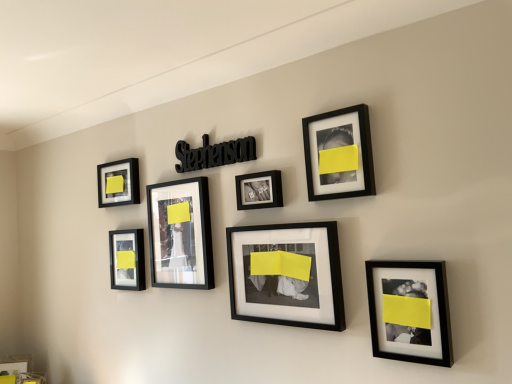
This screenshot has width=512, height=384. In order to click on matte black frame at center, which ranks as the 3th picture frame in left-to-right order in this screenshot , I will do `click(180, 234)`.

What do you see at coordinates (409, 311) in the screenshot?
I see `black matte picture frame at lower right, acting as the 1th picture frame starting from the right` at bounding box center [409, 311].

Describe the element at coordinates (286, 275) in the screenshot. I see `matte black frame at center, which ranks as the third picture frame in right-to-left order` at that location.

Identify the location of matte black frame at center, which ranks as the third picture frame in right-to-left order. The height and width of the screenshot is (384, 512). (286, 275).

Locate an element on the screen. The image size is (512, 384). matte black frame at center, the fifth picture frame in the right-to-left sequence is located at coordinates (180, 234).

Which object is closer to the camera, matte black picture frame at upper left, which ranks as the seventh picture frame in right-to-left order, or matte black frame at center, the fifth picture frame in the right-to-left sequence?

Positioned in front is matte black frame at center, the fifth picture frame in the right-to-left sequence.

Is point (121, 186) farther from camera compared to point (168, 194)?

Yes, it is.

Is matte black picture frame at upper left, acting as the first picture frame starting from the left, spatially inside matte black frame at center, the fifth picture frame in the right-to-left sequence, or outside of it?

matte black picture frame at upper left, acting as the first picture frame starting from the left, exists outside the volume of matte black frame at center, the fifth picture frame in the right-to-left sequence.

From the image's perspective, which one is positioned higher, matte black picture frame at upper left, acting as the first picture frame starting from the left, or matte black frame at center, which ranks as the 3th picture frame in left-to-right order?

matte black picture frame at upper left, acting as the first picture frame starting from the left, appears higher in the image.

Visually, is matte black frame at center, marked as the fifth picture frame in a left-to-right arrangement, positioned to the left or to the right of matte black frame at center, which ranks as the 3th picture frame in left-to-right order?

Based on their positions, matte black frame at center, marked as the fifth picture frame in a left-to-right arrangement, is located to the right of matte black frame at center, which ranks as the 3th picture frame in left-to-right order.

Which is in front, matte black frame at center, marked as the fifth picture frame in a left-to-right arrangement, or matte black frame at center, which ranks as the 3th picture frame in left-to-right order?

matte black frame at center, marked as the fifth picture frame in a left-to-right arrangement.

Considering the sizes of objects matte black frame at center, which ranks as the third picture frame in right-to-left order, and matte black frame at center, which ranks as the 3th picture frame in left-to-right order, in the image provided, who is thinner, matte black frame at center, which ranks as the third picture frame in right-to-left order, or matte black frame at center, which ranks as the 3th picture frame in left-to-right order,?

matte black frame at center, which ranks as the third picture frame in right-to-left order, is thinner.

Is matte black frame at center, marked as the fifth picture frame in a left-to-right arrangement, taller or shorter than matte black frame at center, the fifth picture frame in the right-to-left sequence?

Clearly, matte black frame at center, marked as the fifth picture frame in a left-to-right arrangement, is shorter compared to matte black frame at center, the fifth picture frame in the right-to-left sequence.

In the scene shown: From the image's perspective, which one is positioned lower, matte black frame at center, which ranks as the 3th picture frame in left-to-right order, or black matte picture frame at lower right, acting as the 1th picture frame starting from the right?

black matte picture frame at lower right, acting as the 1th picture frame starting from the right.

Visually, is matte black frame at center, which ranks as the 3th picture frame in left-to-right order, positioned to the left or to the right of black matte picture frame at lower right, which ranks as the 7th picture frame in left-to-right order?

matte black frame at center, which ranks as the 3th picture frame in left-to-right order, is positioned on black matte picture frame at lower right, which ranks as the 7th picture frame in left-to-right order,'s left side.

How many degrees apart are the facing directions of matte black frame at center, the fifth picture frame in the right-to-left sequence, and black matte picture frame at lower right, acting as the 1th picture frame starting from the right?

The facing directions of matte black frame at center, the fifth picture frame in the right-to-left sequence, and black matte picture frame at lower right, acting as the 1th picture frame starting from the right, are 0.00136 degrees apart.

Can you confirm if matte black frame at center, which ranks as the 3th picture frame in left-to-right order, is shorter than black matte picture frame at lower right, acting as the 1th picture frame starting from the right?

Incorrect, the height of matte black frame at center, which ranks as the 3th picture frame in left-to-right order, does not fall short of that of black matte picture frame at lower right, acting as the 1th picture frame starting from the right.

You are a GUI agent. You are given a task and a screenshot of the screen. Output one action in this format:
    pyautogui.click(x=<x>, y=<y>)
    Task: Click on the picture frame above the matte black picture frame at upper left, which ranks as the seventh picture frame in right-to-left order (from the image's perspective)
    This screenshot has width=512, height=384.
    Given the screenshot: What is the action you would take?
    pyautogui.click(x=339, y=154)

From a real-world perspective, is matte black picture frame at upper left, acting as the first picture frame starting from the left, physically located above or below black matte picture frame at upper right, the sixth picture frame viewed from the left?

From a real-world perspective, matte black picture frame at upper left, acting as the first picture frame starting from the left, is physically above black matte picture frame at upper right, the sixth picture frame viewed from the left.

From the image's perspective, is matte black picture frame at upper left, which ranks as the seventh picture frame in right-to-left order, above or below black matte picture frame at upper right, the sixth picture frame viewed from the left?

matte black picture frame at upper left, which ranks as the seventh picture frame in right-to-left order, is below black matte picture frame at upper right, the sixth picture frame viewed from the left.

Is matte black picture frame at upper left, acting as the first picture frame starting from the left, aimed at black matte picture frame at upper right, the sixth picture frame viewed from the left?

No, matte black picture frame at upper left, acting as the first picture frame starting from the left, is not aimed at black matte picture frame at upper right, the sixth picture frame viewed from the left.

Is point (140, 276) behind point (446, 341)?

Yes, it is behind point (446, 341).

Looking at this image, is matte black picture frame at lower left, the 6th picture frame when ordered from right to left, facing towards black matte picture frame at lower right, acting as the 1th picture frame starting from the right?

No, matte black picture frame at lower left, the 6th picture frame when ordered from right to left, does not turn towards black matte picture frame at lower right, acting as the 1th picture frame starting from the right.

Looking at their sizes, would you say matte black picture frame at lower left, the 6th picture frame when ordered from right to left, is wider or thinner than black matte picture frame at lower right, acting as the 1th picture frame starting from the right?

In the image, matte black picture frame at lower left, the 6th picture frame when ordered from right to left, appears to be more narrow than black matte picture frame at lower right, acting as the 1th picture frame starting from the right.

Which object is closer to the camera taking this photo, black matte picture frame at upper right, the sixth picture frame viewed from the left, or matte black picture frame at upper left, acting as the first picture frame starting from the left?

black matte picture frame at upper right, the sixth picture frame viewed from the left, is in front.

Considering the sizes of objects black matte picture frame at upper right, the 2th picture frame viewed from the right, and matte black picture frame at upper left, acting as the first picture frame starting from the left, in the image provided, who is wider, black matte picture frame at upper right, the 2th picture frame viewed from the right, or matte black picture frame at upper left, acting as the first picture frame starting from the left,?

black matte picture frame at upper right, the 2th picture frame viewed from the right.

How many degrees apart are the facing directions of black matte picture frame at upper right, the 2th picture frame viewed from the right, and matte black picture frame at upper left, acting as the first picture frame starting from the left?

They differ by 5.27e-05 degrees in their facing directions.

Between point (359, 117) and point (105, 185), which one is positioned in front?

The point (359, 117) is more forward.

Could you measure the distance between matte black picture frame at lower left, the 2th picture frame in the left-to-right sequence, and matte black photo frame at center, marked as the 4th picture frame in a right-to-left arrangement?

matte black picture frame at lower left, the 2th picture frame in the left-to-right sequence, and matte black photo frame at center, marked as the 4th picture frame in a right-to-left arrangement, are 26.17 inches apart from each other.

From the image's perspective, between matte black picture frame at lower left, the 2th picture frame in the left-to-right sequence, and matte black photo frame at center, positioned as the 4th picture frame in left-to-right order, which one is located above?

matte black photo frame at center, positioned as the 4th picture frame in left-to-right order, appears higher in the image.

Does matte black picture frame at lower left, the 2th picture frame in the left-to-right sequence, touch matte black photo frame at center, marked as the 4th picture frame in a right-to-left arrangement?

matte black picture frame at lower left, the 2th picture frame in the left-to-right sequence, and matte black photo frame at center, marked as the 4th picture frame in a right-to-left arrangement, are not in contact.

What's the angular difference between matte black picture frame at lower left, the 2th picture frame in the left-to-right sequence, and matte black photo frame at center, marked as the 4th picture frame in a right-to-left arrangement,'s facing directions?

The angle between the facing direction of matte black picture frame at lower left, the 2th picture frame in the left-to-right sequence, and the facing direction of matte black photo frame at center, marked as the 4th picture frame in a right-to-left arrangement, is 0.00132 degrees.

Where is `picture frame that is the 3rd object above the matte black frame at center, the fifth picture frame in the right-to-left sequence (from a real-world perspective)`? Image resolution: width=512 pixels, height=384 pixels. picture frame that is the 3rd object above the matte black frame at center, the fifth picture frame in the right-to-left sequence (from a real-world perspective) is located at coordinates (118, 183).

Starting from the matte black frame at center, marked as the fifth picture frame in a left-to-right arrangement, which picture frame is the 2nd one behind? Please provide its 2D coordinates.

[(180, 234)]

Considering their positions, is matte black photo frame at center, marked as the 4th picture frame in a right-to-left arrangement, positioned closer to matte black frame at center, which ranks as the third picture frame in right-to-left order, than matte black frame at center, which ranks as the 3th picture frame in left-to-right order?

matte black photo frame at center, marked as the 4th picture frame in a right-to-left arrangement, is positioned closer to the anchor matte black frame at center, which ranks as the third picture frame in right-to-left order.

From the picture: Looking at the image, which one is located closer to matte black frame at center, which ranks as the 3th picture frame in left-to-right order, matte black picture frame at upper left, which ranks as the seventh picture frame in right-to-left order, or black matte picture frame at upper right, the sixth picture frame viewed from the left?

matte black picture frame at upper left, which ranks as the seventh picture frame in right-to-left order, is closer to matte black frame at center, which ranks as the 3th picture frame in left-to-right order.

Which object lies nearer to the anchor point matte black frame at center, which ranks as the 3th picture frame in left-to-right order, matte black frame at center, marked as the fifth picture frame in a left-to-right arrangement, or matte black picture frame at upper left, which ranks as the seventh picture frame in right-to-left order?

The object closer to matte black frame at center, which ranks as the 3th picture frame in left-to-right order, is matte black frame at center, marked as the fifth picture frame in a left-to-right arrangement.

Considering their positions, is matte black frame at center, which ranks as the third picture frame in right-to-left order, positioned closer to matte black picture frame at lower left, the 2th picture frame in the left-to-right sequence, than matte black picture frame at upper left, which ranks as the seventh picture frame in right-to-left order?

Based on the image, matte black picture frame at upper left, which ranks as the seventh picture frame in right-to-left order, appears to be nearer to matte black picture frame at lower left, the 2th picture frame in the left-to-right sequence.

Looking at the image, which one is located closer to matte black frame at center, marked as the fifth picture frame in a left-to-right arrangement, matte black picture frame at upper left, acting as the first picture frame starting from the left, or matte black photo frame at center, marked as the 4th picture frame in a right-to-left arrangement?

Among the two, matte black photo frame at center, marked as the 4th picture frame in a right-to-left arrangement, is located nearer to matte black frame at center, marked as the fifth picture frame in a left-to-right arrangement.

Looking at the image, which one is located closer to matte black photo frame at center, positioned as the 4th picture frame in left-to-right order, matte black frame at center, the fifth picture frame in the right-to-left sequence, or matte black picture frame at upper left, acting as the first picture frame starting from the left?

The object closer to matte black photo frame at center, positioned as the 4th picture frame in left-to-right order, is matte black frame at center, the fifth picture frame in the right-to-left sequence.

Looking at this image, looking at the image, which one is located further to matte black picture frame at upper left, which ranks as the seventh picture frame in right-to-left order, matte black picture frame at lower left, the 6th picture frame when ordered from right to left, or matte black frame at center, the fifth picture frame in the right-to-left sequence?

matte black frame at center, the fifth picture frame in the right-to-left sequence, is further to matte black picture frame at upper left, which ranks as the seventh picture frame in right-to-left order.

Which object lies further to the anchor point matte black photo frame at center, marked as the 4th picture frame in a right-to-left arrangement, matte black picture frame at lower left, the 2th picture frame in the left-to-right sequence, or matte black picture frame at upper left, acting as the first picture frame starting from the left?

Based on the image, matte black picture frame at upper left, acting as the first picture frame starting from the left, appears to be further to matte black photo frame at center, marked as the 4th picture frame in a right-to-left arrangement.

The width and height of the screenshot is (512, 384). I want to click on picture frame between matte black frame at center, the fifth picture frame in the right-to-left sequence, and matte black frame at center, which ranks as the third picture frame in right-to-left order, in the horizontal direction, so click(x=259, y=190).

Locate an element on the screen. The image size is (512, 384). picture frame between matte black picture frame at lower left, the 6th picture frame when ordered from right to left, and matte black photo frame at center, marked as the 4th picture frame in a right-to-left arrangement is located at coordinates (180, 234).

Identify the location of picture frame located between matte black picture frame at upper left, which ranks as the seventh picture frame in right-to-left order, and matte black frame at center, the fifth picture frame in the right-to-left sequence, in the left-right direction. (127, 259).